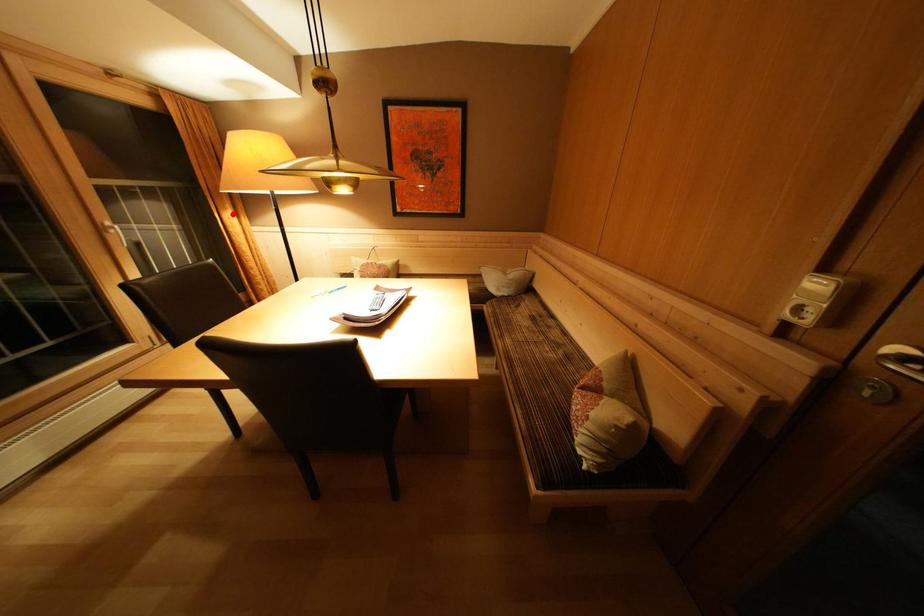
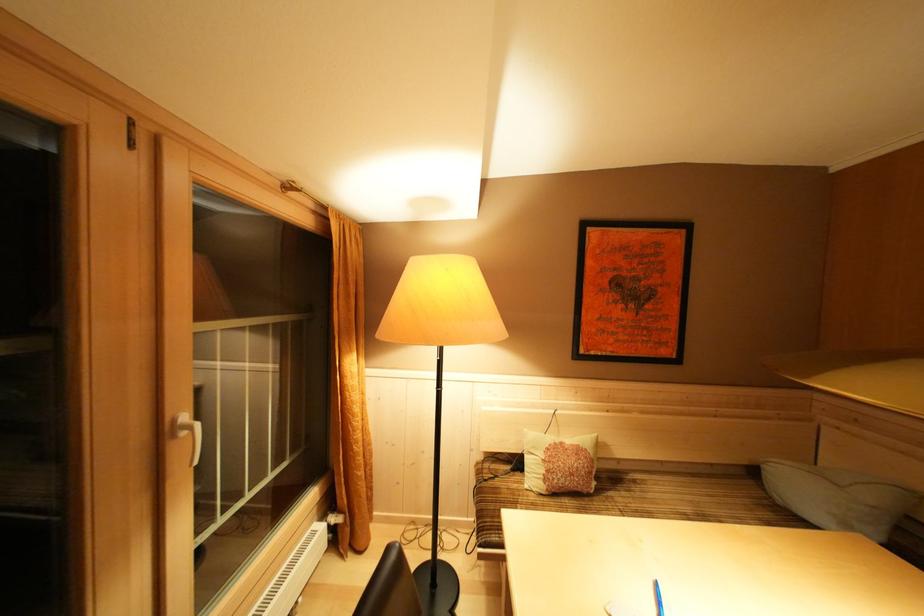
In the second image, find the point that corresponds to the highlighted location in the first image.

(358, 357)